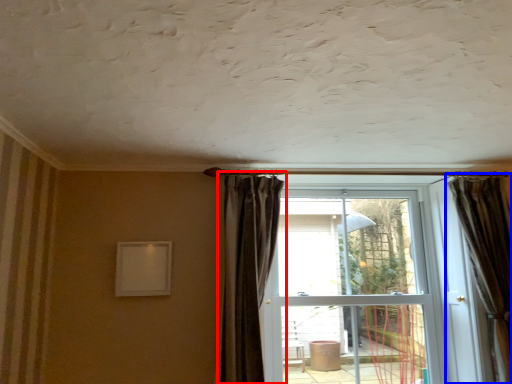
Question: Which point is further to the camera, curtain (highlighted by a red box) or curtain (highlighted by a blue box)?

Choices:
 (A) curtain
 (B) curtain

Answer: (B)